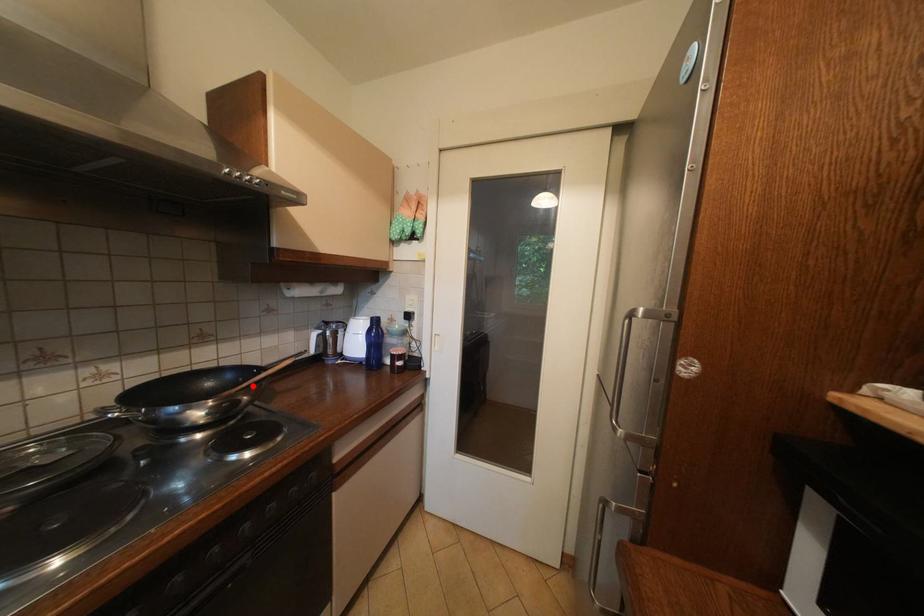
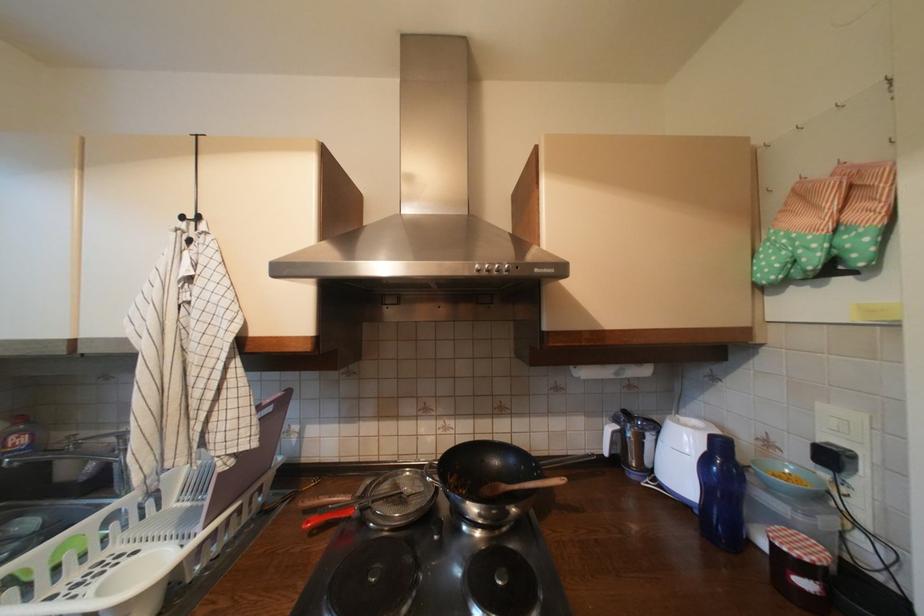
Question: I am providing you with two images of the same scene from different viewpoints. A red point is shown in image1. For the corresponding object point in image2, is it positioned nearer or farther from the camera?

Choices:
 (A) Nearer
 (B) Farther

Answer: (B)